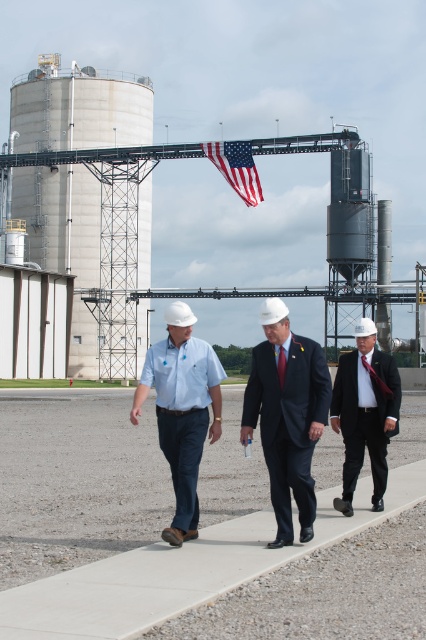
Question: Can you confirm if concrete at center is positioned above matte black suit at center?

Choices:
 (A) no
 (B) yes

Answer: (A)

Question: In this image, where is matte blue shirt at center located relative to american flag at center?

Choices:
 (A) right
 (B) left

Answer: (B)

Question: Which of the following is the closest to the observer?

Choices:
 (A) matte black suit at center
 (B) gray concrete silo at upper left

Answer: (A)

Question: Does matte black suit at center have a smaller size compared to matte red tie at center?

Choices:
 (A) yes
 (B) no

Answer: (B)

Question: Which object is positioned closest to the gray concrete silo at upper left?

Choices:
 (A) american flag at center
 (B) matte black suit at center

Answer: (A)

Question: Which object appears farthest from the camera in this image?

Choices:
 (A) dark blue suit at center
 (B) concrete at center
 (C) gray concrete silo at upper left
 (D) dark red silk tie at center

Answer: (C)